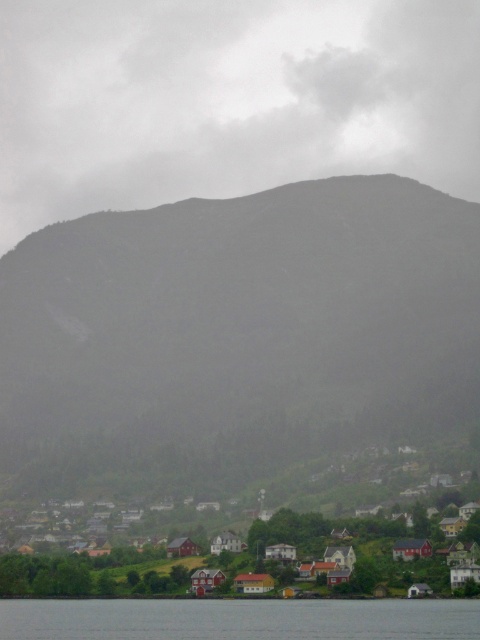
Question: Which of the following is the closest to the observer?

Choices:
 (A) (34, 630)
 (B) (111, 401)

Answer: (A)

Question: Does green textured mountain at center have a greater width compared to transparent water at lower center?

Choices:
 (A) no
 (B) yes

Answer: (B)

Question: Which point is farther to the camera?

Choices:
 (A) red wooden houses at lower center
 (B) green textured mountain at center

Answer: (B)

Question: Which of the following is the closest to the observer?

Choices:
 (A) transparent water at lower center
 (B) green textured mountain at center

Answer: (A)

Question: Is red wooden houses at lower center above transparent water at lower center?

Choices:
 (A) yes
 (B) no

Answer: (A)

Question: Does green textured mountain at center appear on the left side of red wooden houses at lower center?

Choices:
 (A) yes
 (B) no

Answer: (A)